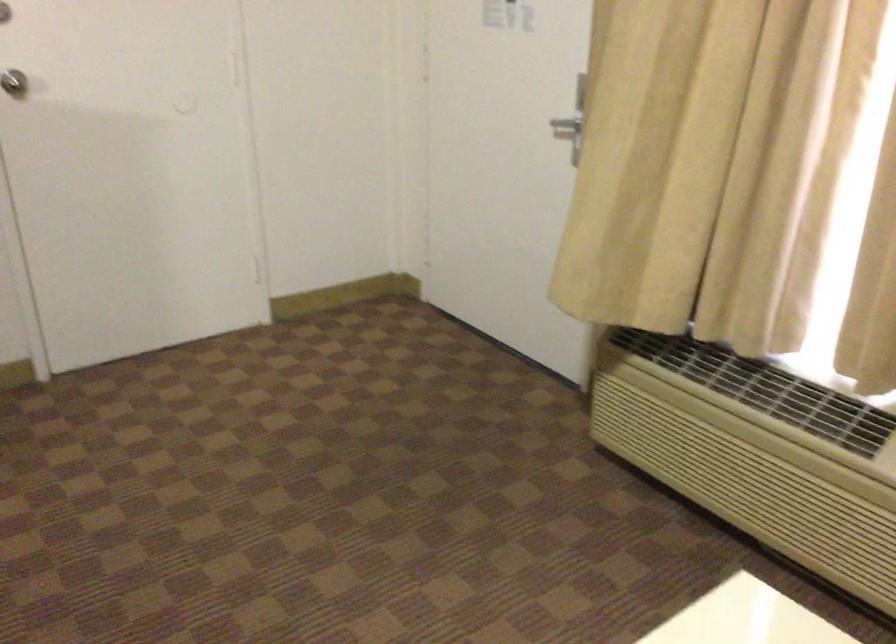
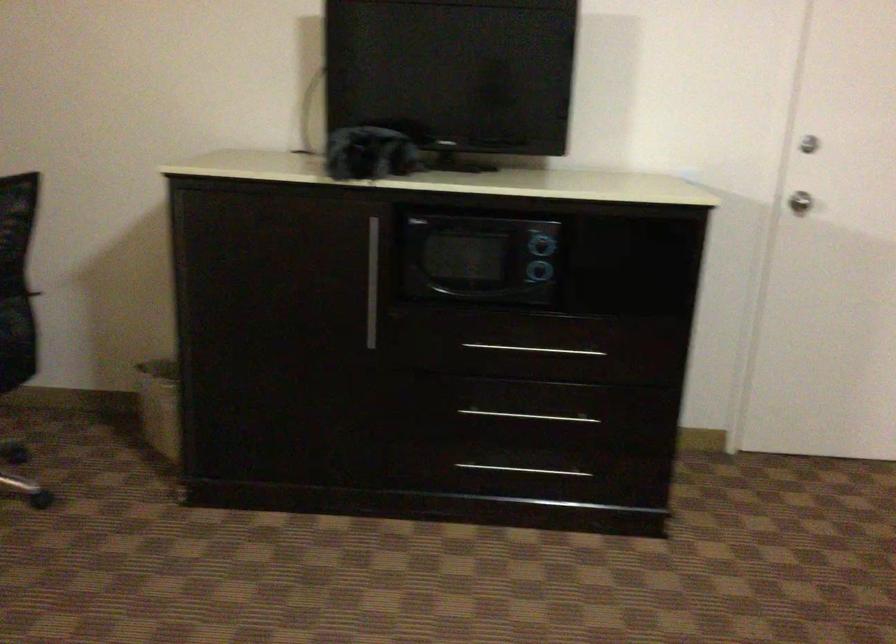
Question: Based on the continuous images, in which direction is the camera rotating? Reply with the corresponding letter.

Choices:
 (A) Left
 (B) Right
 (C) Up
 (D) Down

Answer: (A)